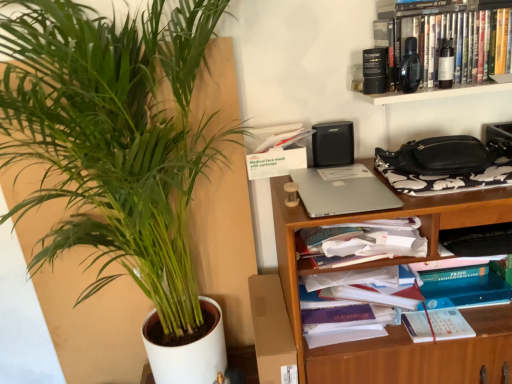
This screenshot has height=384, width=512. In order to click on blank space above silver metallic laptop at center-right (from a real-world perspective) in this screenshot , I will do `click(342, 187)`.